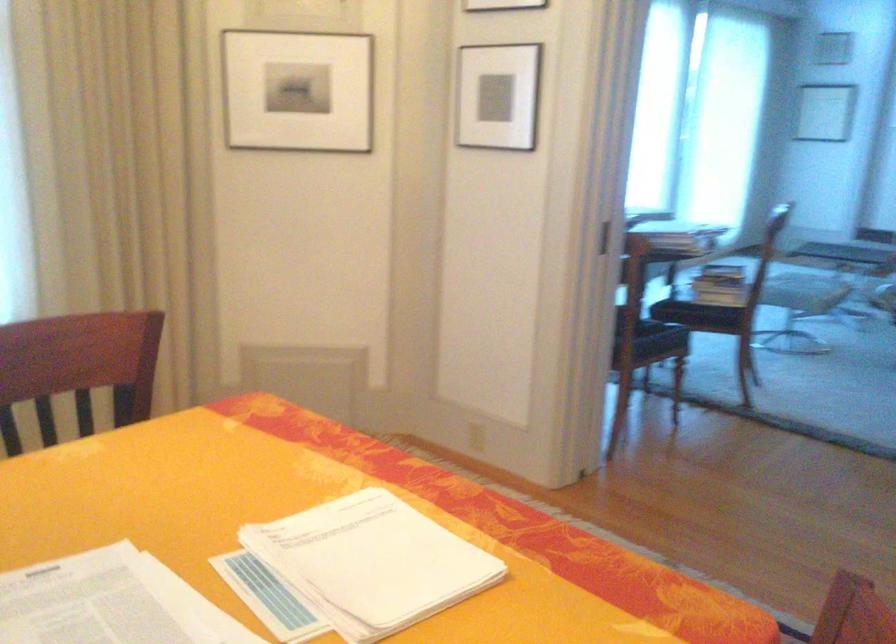
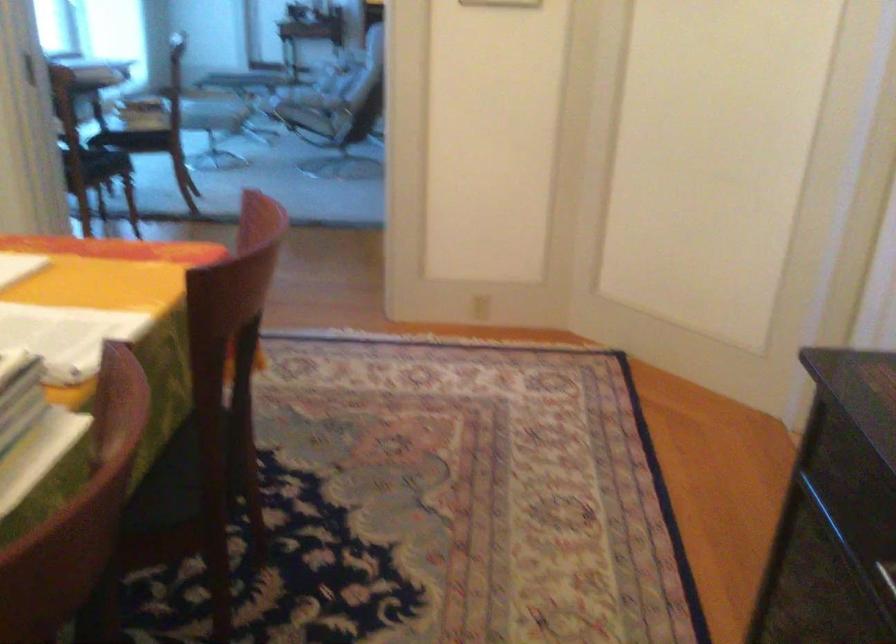
Question: How did the camera likely rotate?

Choices:
 (A) Left
 (B) Right
 (C) Up
 (D) Down

Answer: (B)